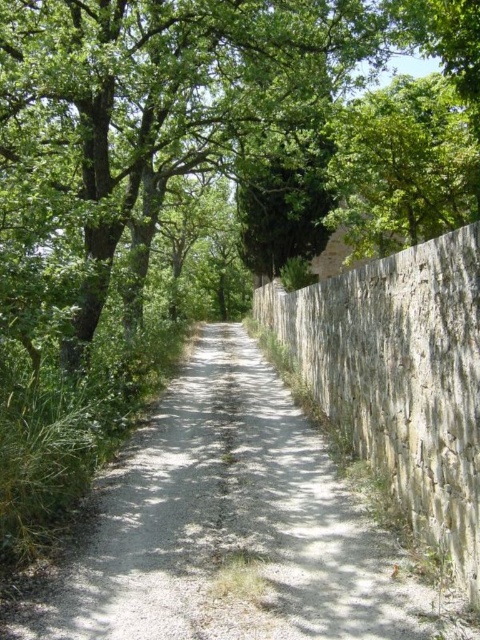
Can you confirm if green leafy tree at center is positioned above gray gravel path at center?

Correct, green leafy tree at center is located above gray gravel path at center.

The width and height of the screenshot is (480, 640). What are the coordinates of `green leafy tree at center` in the screenshot? It's located at (210, 161).